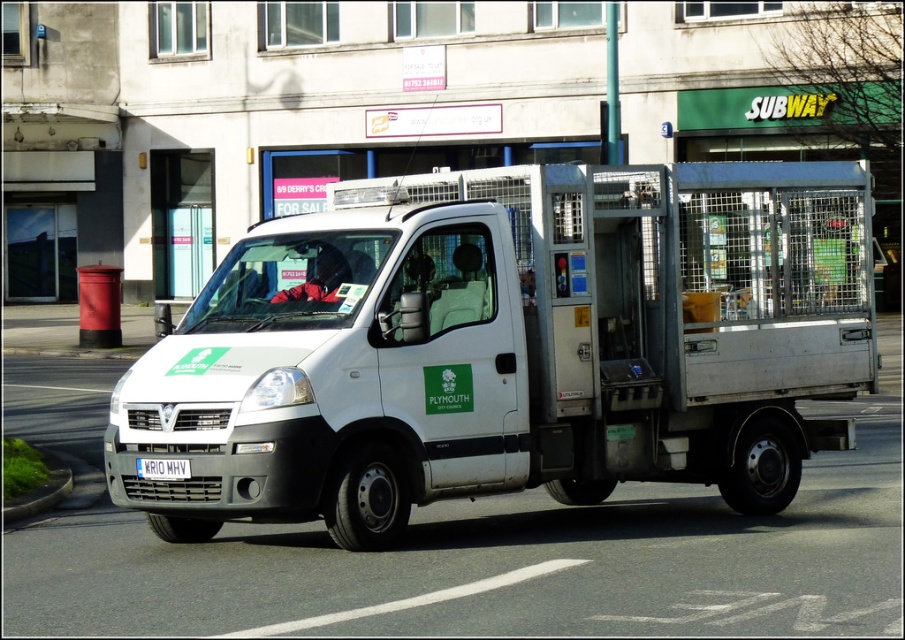
Question: Among these points, which one is nearest to the camera?

Choices:
 (A) (x=264, y=294)
 (B) (x=170, y=472)

Answer: (B)

Question: Which point is closer to the camera taking this photo?

Choices:
 (A) (410, 216)
 (B) (158, 472)

Answer: (B)

Question: Does white matte van at center come in front of white metallic license plate at center?

Choices:
 (A) no
 (B) yes

Answer: (B)

Question: Which point is closer to the camera?

Choices:
 (A) white metallic license plate at center
 (B) white matte van at center

Answer: (B)

Question: Can you confirm if white matte van at center is thinner than white metallic license plate at center?

Choices:
 (A) yes
 (B) no

Answer: (B)

Question: Is white matte van at center to the left of white metallic license plate at center from the viewer's perspective?

Choices:
 (A) no
 (B) yes

Answer: (A)